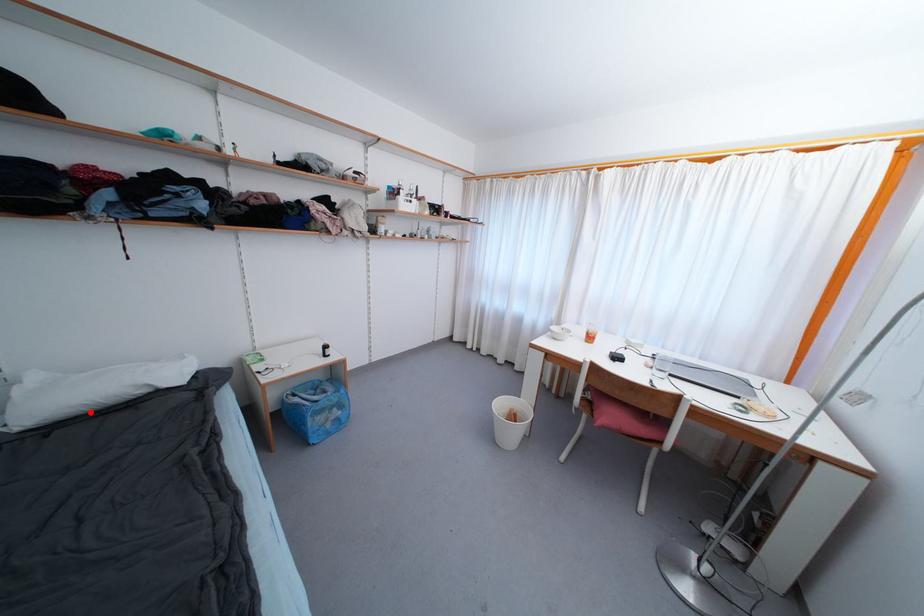
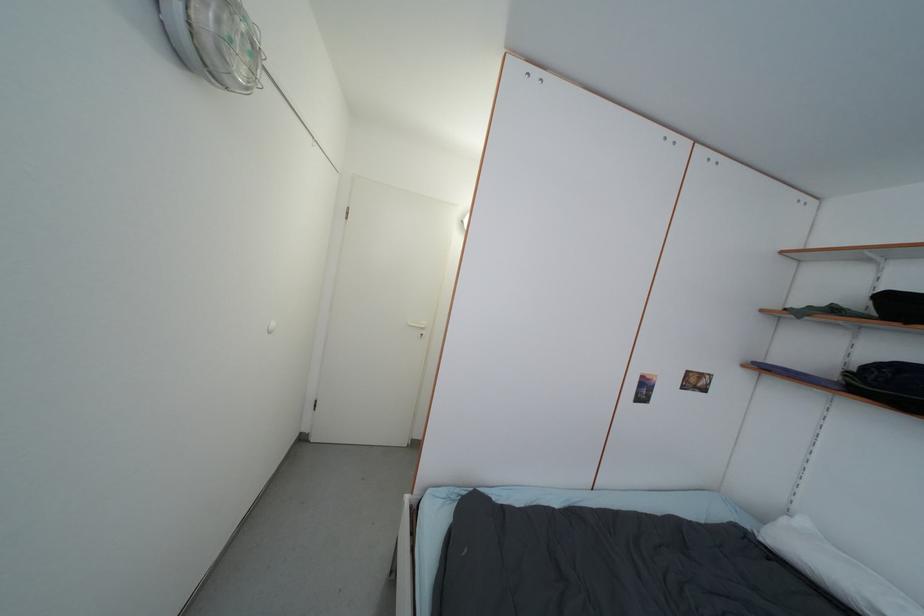
Where in the second image is the point corresponding to the highlighted location from the first image?

(812, 576)